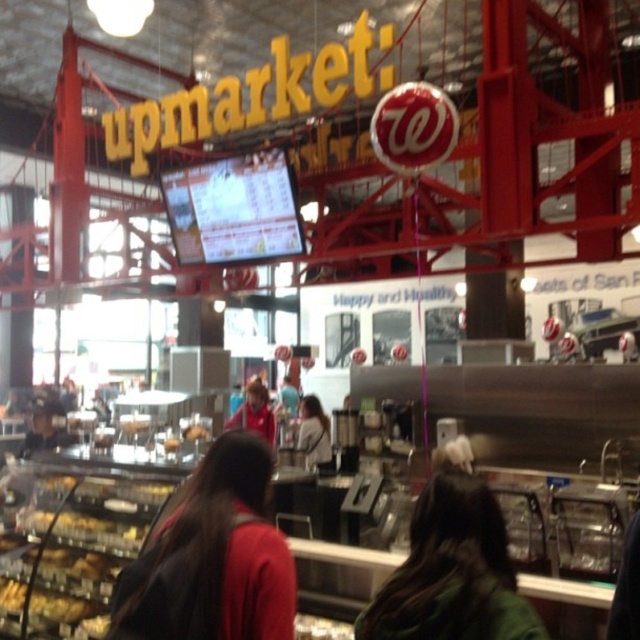
Question: Does green fabric at center have a larger size compared to translucent plastic tray at lower left?

Choices:
 (A) yes
 (B) no

Answer: (B)

Question: Does dark brown leather jacket at center have a larger size compared to translucent plastic tray at lower left?

Choices:
 (A) no
 (B) yes

Answer: (A)

Question: Which point is farther to the camera?

Choices:
 (A) (60, 532)
 (B) (296, 449)

Answer: (B)

Question: Is green fabric at center thinner than white fabric shirt at center?

Choices:
 (A) yes
 (B) no

Answer: (B)

Question: Estimate the real-world distances between objects in this image. Which object is closer to the dark brown leather jacket at center?

Choices:
 (A) green fabric at center
 (B) white fabric shirt at center

Answer: (A)

Question: Which object is positioned closest to the dark brown leather jacket at center?

Choices:
 (A) green fabric at center
 (B) white fabric shirt at center
 (C) translucent plastic tray at lower left

Answer: (A)